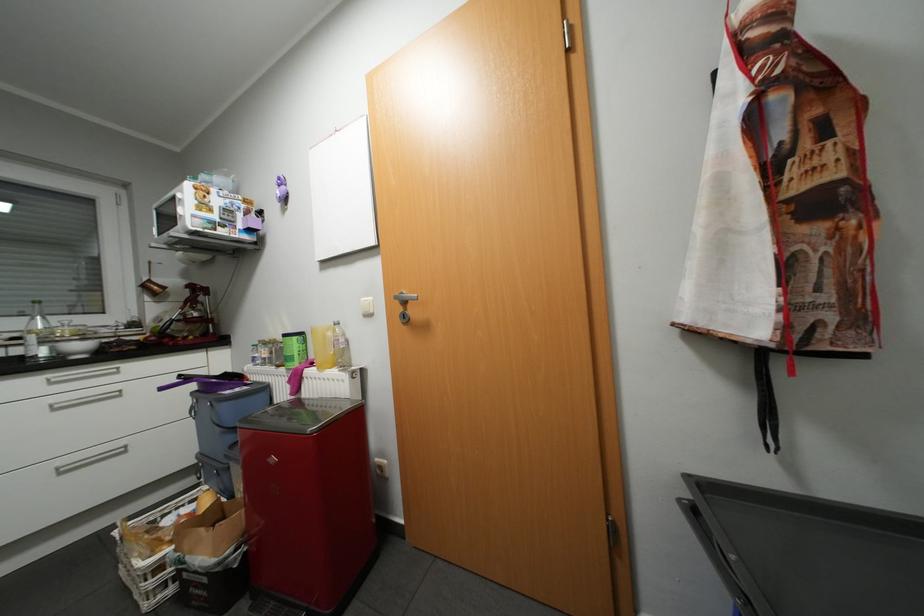
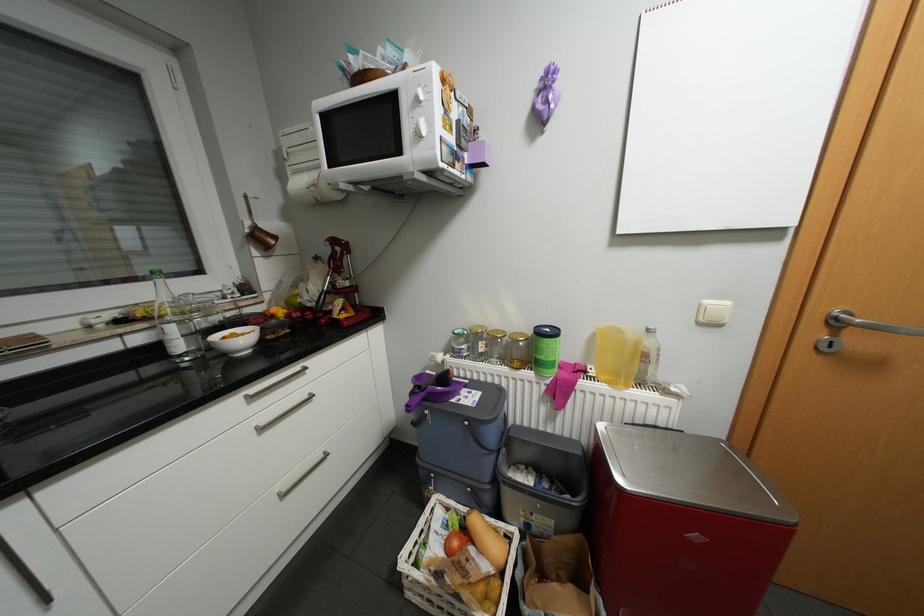
In the second image, find the point that corresponds to (91,346) in the first image.

(249, 339)